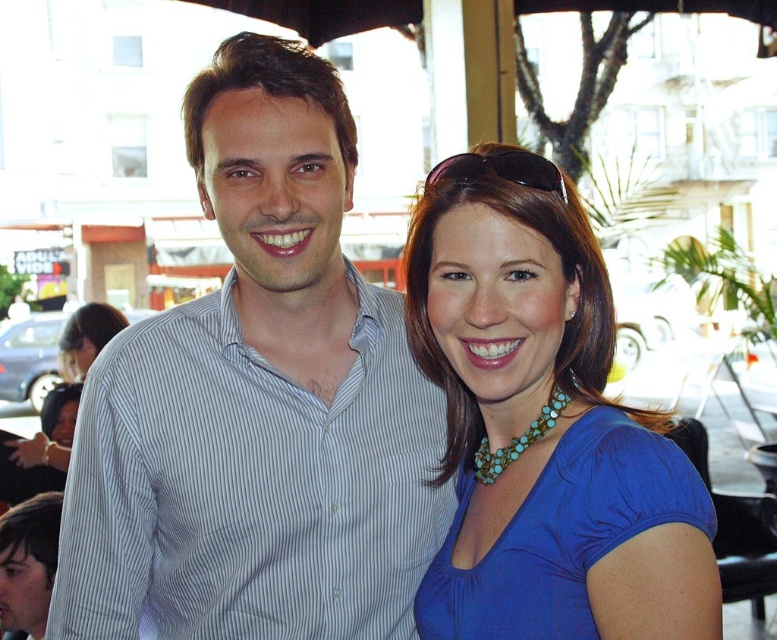
Is light blue striped shirt at center thinner than turquoise beaded necklace at center?

Incorrect, light blue striped shirt at center's width is not less than turquoise beaded necklace at center's.

The image size is (777, 640). I want to click on light blue striped shirt at center, so click(x=258, y=403).

Between blue fabric dress at center and turquoise beaded necklace at center, which one is positioned higher?

Positioned higher is turquoise beaded necklace at center.

Locate an element on the screen. blue fabric dress at center is located at coordinates (561, 532).

Does light blue striped shirt at center come in front of blue beaded necklace at center?

No, light blue striped shirt at center is behind blue beaded necklace at center.

Between point (301, 353) and point (650, 589), which one is positioned behind?

The point (301, 353) is more distant.

Image resolution: width=777 pixels, height=640 pixels. Identify the location of light blue striped shirt at center. (258, 403).